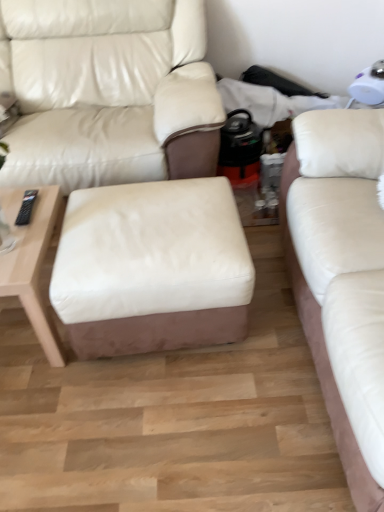
At what (x,y) coordinates should I click in order to perform the action: click on blank space situated above white leather ottoman at center (from a real-world perspective). Please return your answer as a coordinate pair (x, y). This screenshot has width=384, height=512. Looking at the image, I should click on (150, 224).